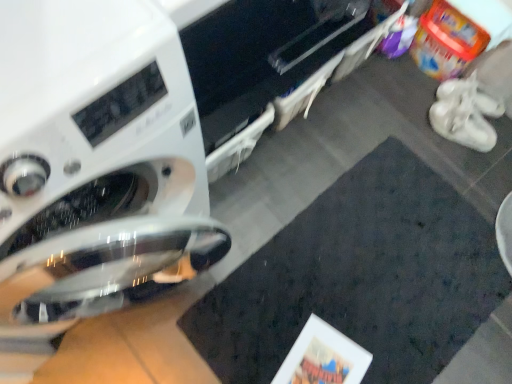
Locate an element on the screen. vacant region to the left of white matte shoe at right is located at coordinates (410, 99).